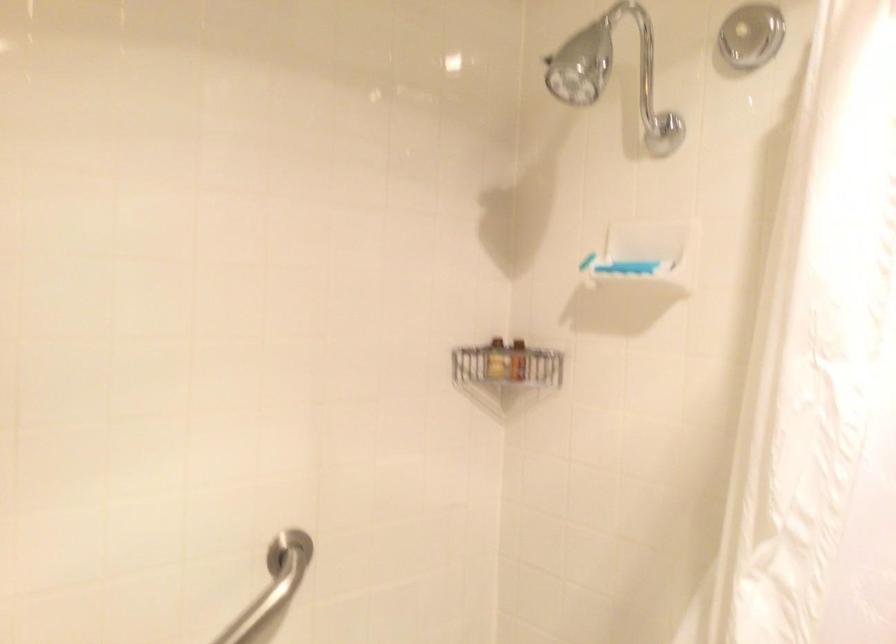
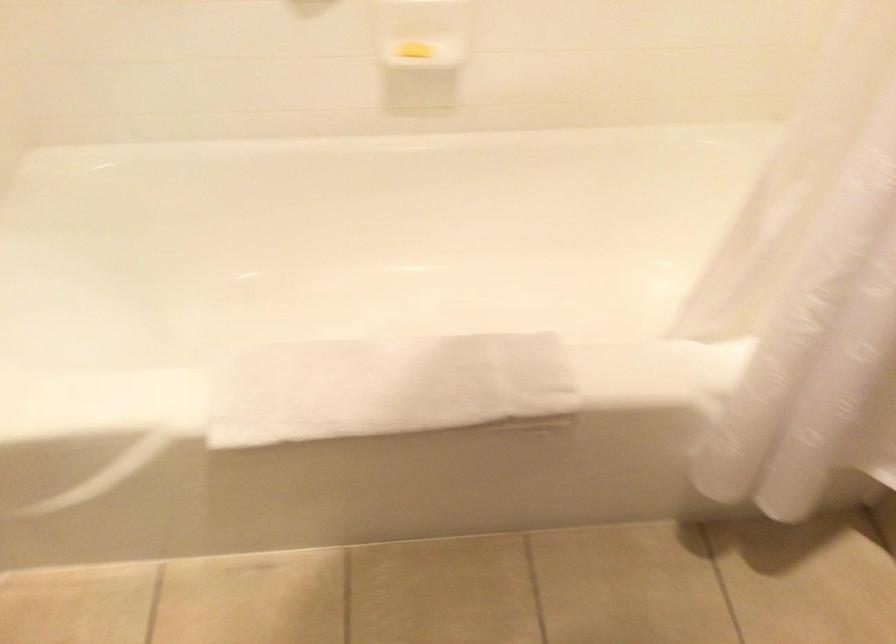
The images are taken continuously from a first-person perspective. In which direction is your viewpoint rotating?

The rotation direction of the camera is left-down.